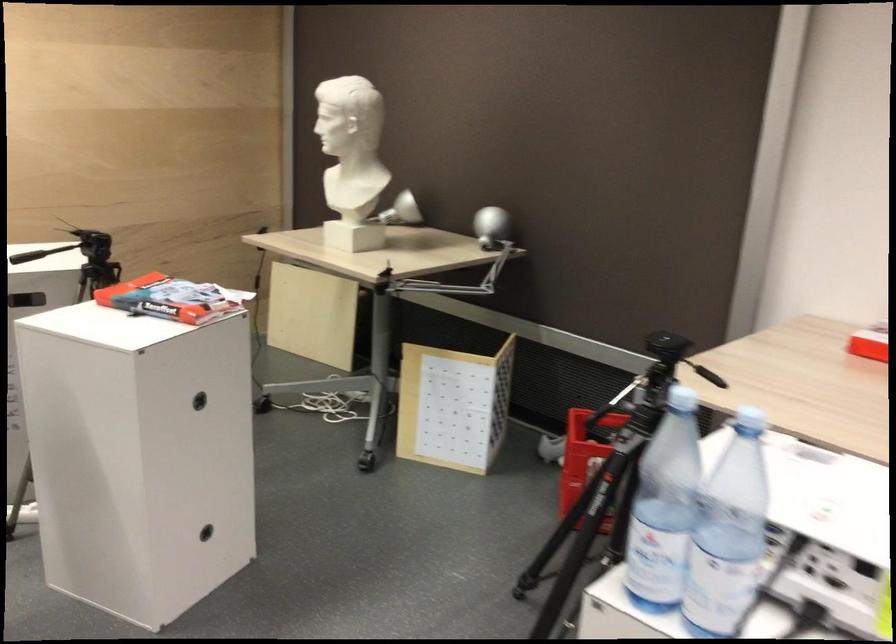
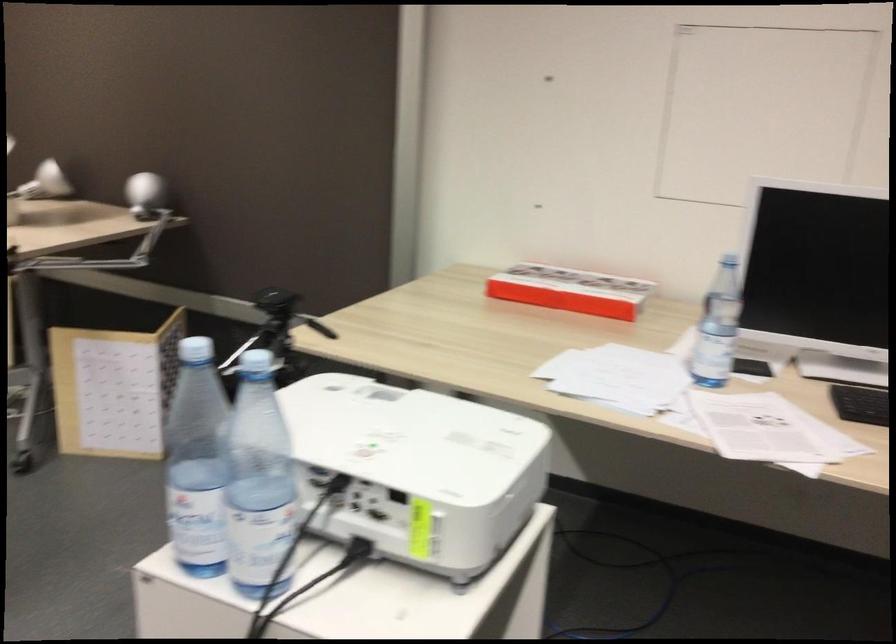
Question: The images are taken continuously from a first-person perspective. In which direction are you moving?

Choices:
 (A) Left
 (B) Right
 (C) Forward
 (D) Backward

Answer: (B)